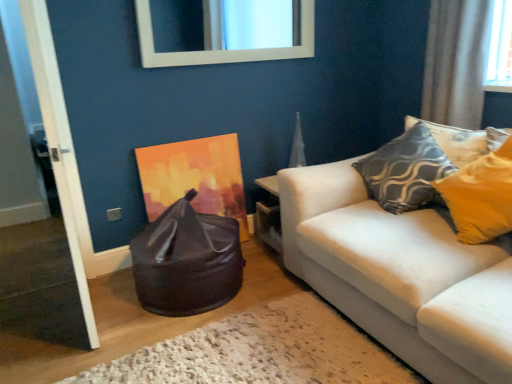
Question: Is white wooden door at left beside textured gray pillow at upper right?

Choices:
 (A) no
 (B) yes

Answer: (A)

Question: Is white wooden door at left at the left side of textured gray pillow at upper right?

Choices:
 (A) no
 (B) yes

Answer: (B)

Question: Does white wooden door at left lie behind textured gray pillow at upper right?

Choices:
 (A) yes
 (B) no

Answer: (B)

Question: Is white wooden door at left closer to the viewer compared to textured gray pillow at upper right?

Choices:
 (A) no
 (B) yes

Answer: (B)

Question: Is white wooden door at left wider than textured gray pillow at upper right?

Choices:
 (A) yes
 (B) no

Answer: (B)

Question: Is textured gray pillow at upper right taller or shorter than glossy black bean bag at lower left?

Choices:
 (A) short
 (B) tall

Answer: (A)

Question: Considering the positions of textured gray pillow at upper right and glossy black bean bag at lower left in the image, is textured gray pillow at upper right wider or thinner than glossy black bean bag at lower left?

Choices:
 (A) thin
 (B) wide

Answer: (A)

Question: From a real-world perspective, is textured gray pillow at upper right physically located above or below glossy black bean bag at lower left?

Choices:
 (A) above
 (B) below

Answer: (A)

Question: Visually, is textured gray pillow at upper right positioned to the left or to the right of glossy black bean bag at lower left?

Choices:
 (A) right
 (B) left

Answer: (A)

Question: Is point (203, 254) positioned closer to the camera than point (308, 24)?

Choices:
 (A) farther
 (B) closer

Answer: (B)

Question: Relative to white glossy mirror at upper center, is glossy black bean bag at lower left in front or behind?

Choices:
 (A) front
 (B) behind

Answer: (A)

Question: From a real-world perspective, is glossy black bean bag at lower left above or below white glossy mirror at upper center?

Choices:
 (A) above
 (B) below

Answer: (B)

Question: From the image's perspective, relative to white glossy mirror at upper center, is glossy black bean bag at lower left above or below?

Choices:
 (A) above
 (B) below

Answer: (B)

Question: From the image's perspective, is textured gray pillow at upper right positioned above or below white wooden door at left?

Choices:
 (A) below
 (B) above

Answer: (B)

Question: Is textured gray pillow at upper right wider or thinner than white wooden door at left?

Choices:
 (A) thin
 (B) wide

Answer: (B)